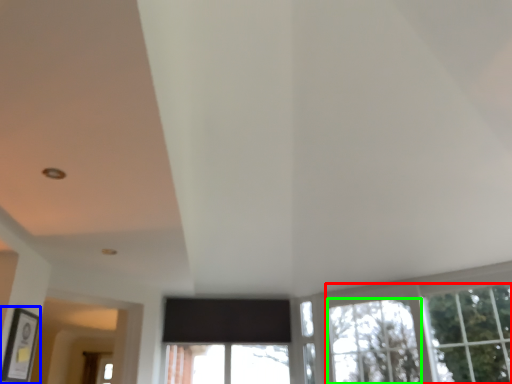
Question: Estimate the real-world distances between objects in this image. Which object is farther from tree (highlighted by a red box), picture frame (highlighted by a blue box) or window (highlighted by a green box)?

Choices:
 (A) picture frame
 (B) window

Answer: (A)